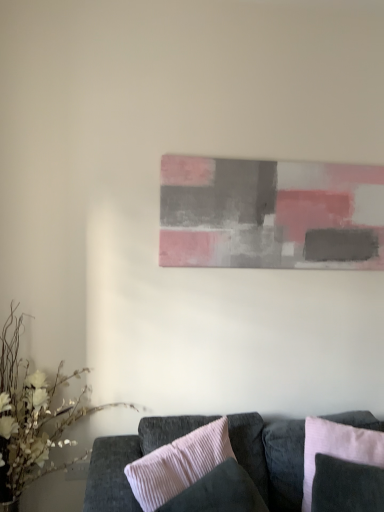
Question: Would you say pink corduroy pillow at center, the 2th pillow when ordered from right to left, is to the left or to the right of velvet dark gray couch at lower center in the picture?

Choices:
 (A) right
 (B) left

Answer: (B)

Question: From a real-world perspective, is pink corduroy pillow at center, the 2th pillow when ordered from right to left, above or below velvet dark gray couch at lower center?

Choices:
 (A) above
 (B) below

Answer: (A)

Question: Which object is the closest to the pink corduroy pillow at lower right, which is the 2th pillow in left-to-right order?

Choices:
 (A) matte gray painting at center
 (B) pink corduroy pillow at center, which ranks as the 1th pillow in left-to-right order
 (C) velvet dark gray couch at lower center
 (D) white matte floral arrangement at lower left

Answer: (C)

Question: Estimate the real-world distances between objects in this image. Which object is farther from the matte gray painting at center?

Choices:
 (A) pink corduroy pillow at lower right, which is the 1th pillow from right to left
 (B) velvet dark gray couch at lower center
 (C) white matte floral arrangement at lower left
 (D) pink corduroy pillow at center, which ranks as the 1th pillow in left-to-right order

Answer: (C)